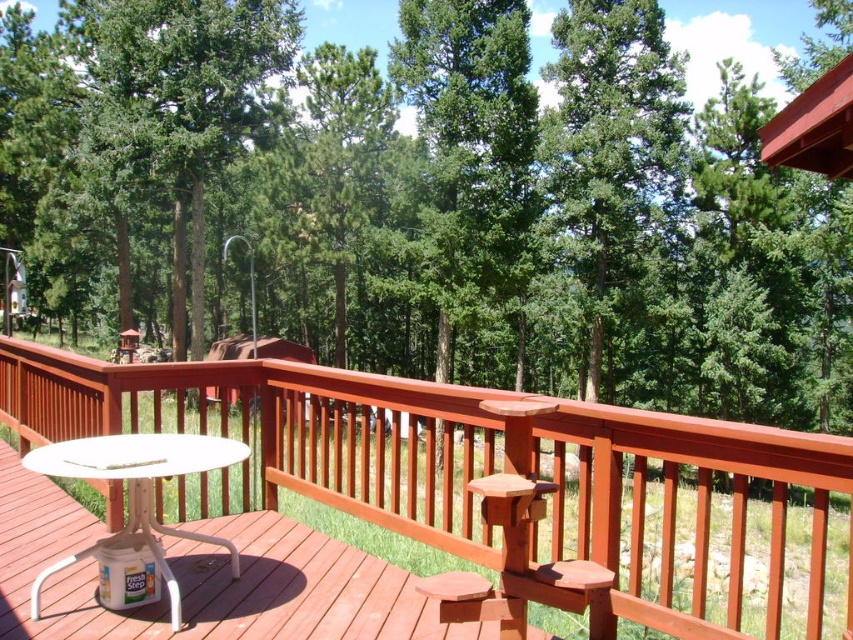
Which is more to the right, white plastic table at center or white plastic table at lower left?

From the viewer's perspective, white plastic table at lower left appears more on the right side.

Does point (306, 566) come closer to viewer compared to point (136, 548)?

No, (306, 566) is further to viewer.

The height and width of the screenshot is (640, 853). What do you see at coordinates (206, 579) in the screenshot?
I see `white plastic table at center` at bounding box center [206, 579].

The height and width of the screenshot is (640, 853). I want to click on white plastic table at center, so click(x=206, y=579).

Does smooth wood balcony at center appear under white plastic table at center?

Correct, smooth wood balcony at center is located below white plastic table at center.

Who is more forward, (561,451) or (250,621)?

Point (561,451) is more forward.

Identify the location of smooth wood balcony at center. (506, 470).

Where is `smooth wood balcony at center`? This screenshot has height=640, width=853. smooth wood balcony at center is located at coordinates (506, 470).

Does smooth wood balcony at center appear over white plastic table at lower left?

Actually, smooth wood balcony at center is below white plastic table at lower left.

Locate an element on the screen. smooth wood balcony at center is located at coordinates (506, 470).